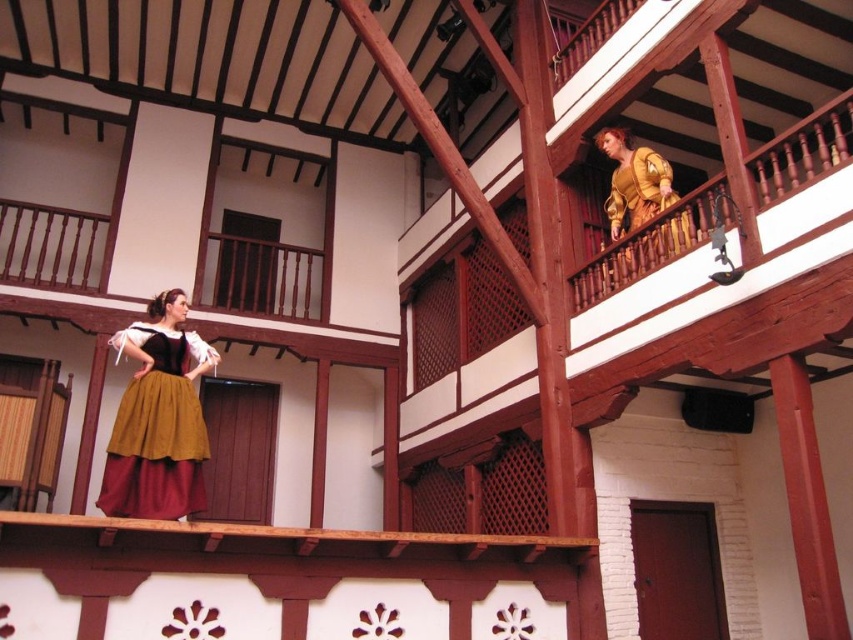
From the picture: Between matte gold skirt at center and golden-yellow fabric dress at upper right, which one has more height?

With more height is matte gold skirt at center.

Does matte gold skirt at center come behind golden-yellow fabric dress at upper right?

No, it is in front of golden-yellow fabric dress at upper right.

Is point (134, 406) farther from viewer compared to point (625, 225)?

No, (134, 406) is closer to viewer.

You are a GUI agent. You are given a task and a screenshot of the screen. Output one action in this format:
    pyautogui.click(x=<x>, y=<y>)
    Task: Click on the matte gold skirt at center
    
    Given the screenshot: What is the action you would take?
    pyautogui.click(x=158, y=419)